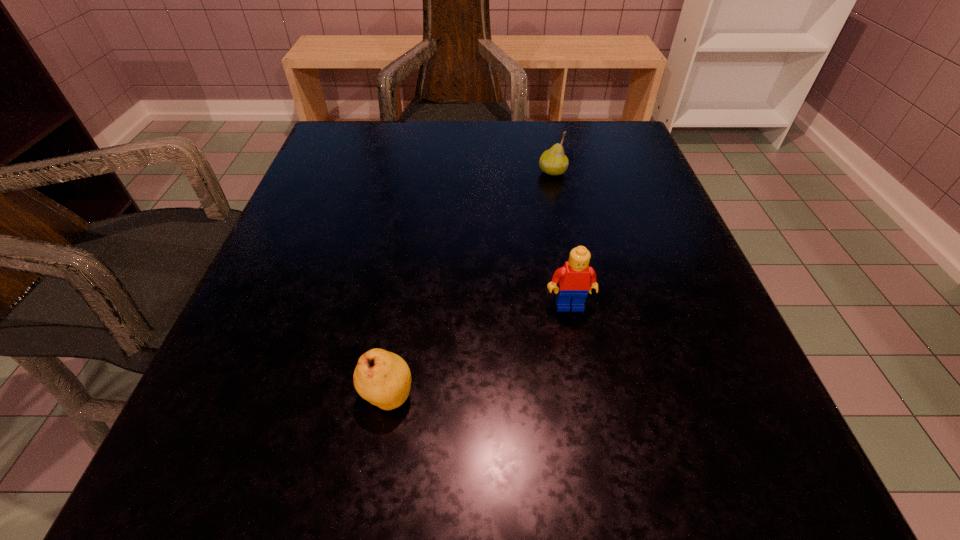
In the image, there is a desktop. At what (x,y) coordinates should I click in order to perform the action: click on free space at the far edge. Please return your answer as a coordinate pair (x, y). Looking at the image, I should click on (477, 153).

Identify the location of free space at the left edge of the desktop. The height and width of the screenshot is (540, 960). (347, 286).

I want to click on vacant space at the right edge of the desktop, so click(740, 367).

In order to click on free space at the far left corner of the desktop in this screenshot , I will do `click(360, 127)`.

Identify the location of vacant region at the far right corner. (577, 176).

Find the location of a particular element. free area in between the Lego and the left pear is located at coordinates (478, 350).

You are a GUI agent. You are given a task and a screenshot of the screen. Output one action in this format:
    pyautogui.click(x=<x>, y=<y>)
    Task: Click on the free space that is in between the Lego and the farthest object
    This screenshot has width=960, height=540.
    Given the screenshot: What is the action you would take?
    pyautogui.click(x=561, y=239)

Locate an element on the screen. The height and width of the screenshot is (540, 960). empty space between the tallest object and the right pear is located at coordinates (561, 239).

Identify the location of free space between the farthest object and the second nearest object. Image resolution: width=960 pixels, height=540 pixels. (561, 239).

I want to click on vacant space that is in between the farther pear and the Lego, so click(x=561, y=239).